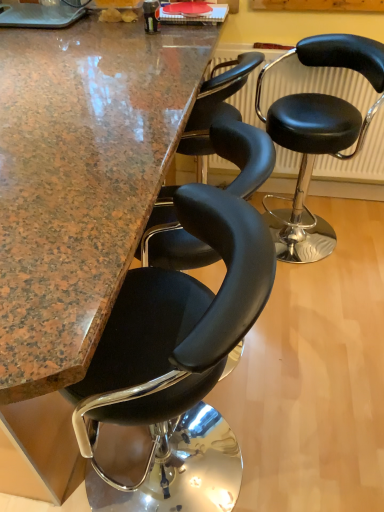
Question: Can you confirm if black leather stool at center, the 2th chair when ordered from right to left, is positioned to the left of granite countertop at center?

Choices:
 (A) yes
 (B) no

Answer: (B)

Question: Does black leather stool at center, the 2th chair from the back, have a larger size compared to granite countertop at center?

Choices:
 (A) yes
 (B) no

Answer: (B)

Question: Are black leather stool at center, the 2th chair from the back, and granite countertop at center beside each other?

Choices:
 (A) yes
 (B) no

Answer: (B)

Question: Considering the relative sizes of black leather stool at center, the 2th chair when ordered from right to left, and granite countertop at center in the image provided, is black leather stool at center, the 2th chair when ordered from right to left, wider than granite countertop at center?

Choices:
 (A) no
 (B) yes

Answer: (A)

Question: Is black leather stool at center, the first chair in the left-to-right sequence, to the right of granite countertop at center from the viewer's perspective?

Choices:
 (A) yes
 (B) no

Answer: (A)

Question: Is black leather stool at center, the 2th chair from the back, smaller than granite countertop at center?

Choices:
 (A) yes
 (B) no

Answer: (A)

Question: Is black leather stool at center, placed as the first chair when sorted from back to front, positioned with its back to granite countertop at center?

Choices:
 (A) yes
 (B) no

Answer: (B)

Question: Considering the relative sizes of black leather stool at center, placed as the first chair when sorted from back to front, and granite countertop at center in the image provided, is black leather stool at center, placed as the first chair when sorted from back to front, smaller than granite countertop at center?

Choices:
 (A) no
 (B) yes

Answer: (B)

Question: Is granite countertop at center inside black leather stool at center, placed as the first chair when sorted from back to front?

Choices:
 (A) no
 (B) yes

Answer: (A)

Question: Is black leather stool at center, marked as the first chair in a right-to-left arrangement, beside granite countertop at center?

Choices:
 (A) no
 (B) yes

Answer: (A)

Question: From the image's perspective, is black leather stool at center, the second chair when ordered from front to back, under granite countertop at center?

Choices:
 (A) no
 (B) yes

Answer: (A)

Question: Is black leather stool at center, the second chair when ordered from front to back, further to the viewer compared to granite countertop at center?

Choices:
 (A) no
 (B) yes

Answer: (B)

Question: Is black leather stool at center, arranged as the first chair when viewed from the front, thinner than black leather radiator at center?

Choices:
 (A) no
 (B) yes

Answer: (A)